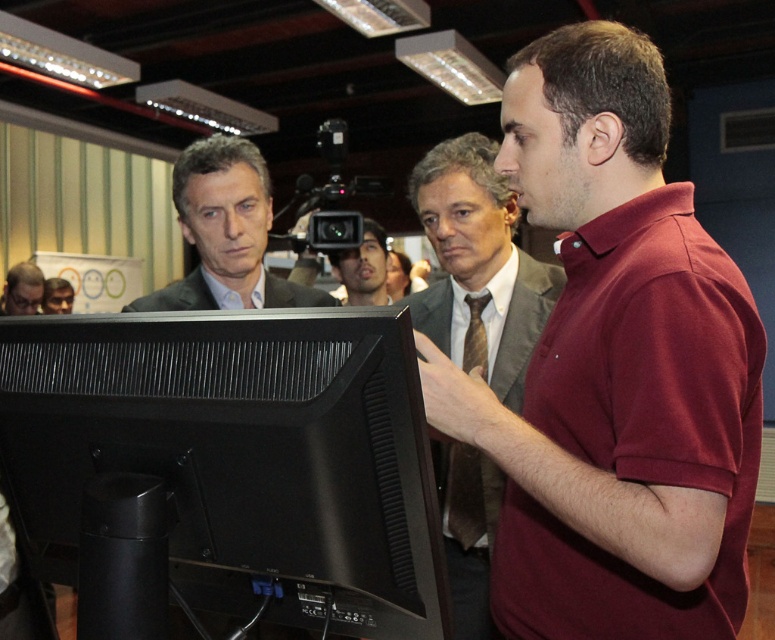
Question: Which of these objects is positioned farthest from the matte black camera at center?

Choices:
 (A) matte gray suit at center
 (B) matte black monitor at lower left
 (C) matte black monitor at center
 (D) maroon cotton polo shirt at right

Answer: (D)

Question: Is maroon cotton polo shirt at right wider than matte gray suit at center?

Choices:
 (A) yes
 (B) no

Answer: (A)

Question: Based on their relative distances, which object is farther from the matte black monitor at lower left?

Choices:
 (A) black matte monitor at center
 (B) matte gray suit at center

Answer: (A)

Question: Which point is farther to the camera?

Choices:
 (A) matte black suit at center
 (B) matte black camera at center
 (C) matte black monitor at lower left

Answer: (C)

Question: Is matte gray suit at center smaller than matte black monitor at lower left?

Choices:
 (A) yes
 (B) no

Answer: (B)

Question: Is matte gray suit at center to the left of matte black monitor at center from the viewer's perspective?

Choices:
 (A) yes
 (B) no

Answer: (B)